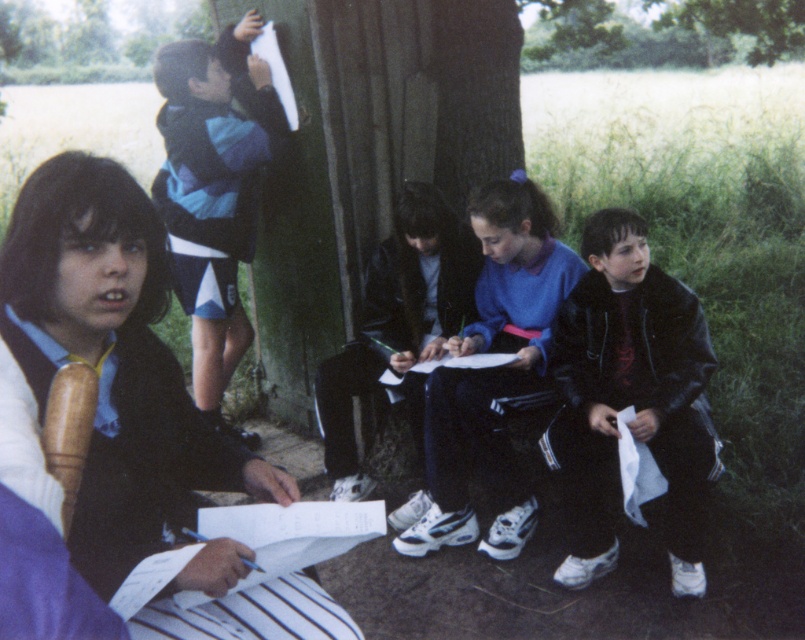
Question: Is dark blue jacket at center closer to the viewer compared to green leafy tree at upper left?

Choices:
 (A) no
 (B) yes

Answer: (B)

Question: Which point appears farthest from the camera in this image?

Choices:
 (A) (448, 244)
 (B) (502, 385)
 (C) (611, 512)

Answer: (A)

Question: Is matte black vest at lower left closer to the viewer compared to blue fleece jacket at center?

Choices:
 (A) yes
 (B) no

Answer: (A)

Question: Among these objects, which one is nearest to the camera?

Choices:
 (A) blue striped shirt at upper left
 (B) matte black vest at lower left
 (C) dark blue jacket at center

Answer: (B)

Question: Considering the real-world distances, which object is farthest from the green leafy tree at upper left?

Choices:
 (A) dark blue jacket at center
 (B) blue fleece jacket at center
 (C) black leather jacket at lower right
 (D) blue striped shirt at upper left

Answer: (C)

Question: Can you confirm if blue striped shirt at upper left is wider than green leafy tree at upper left?

Choices:
 (A) yes
 (B) no

Answer: (B)